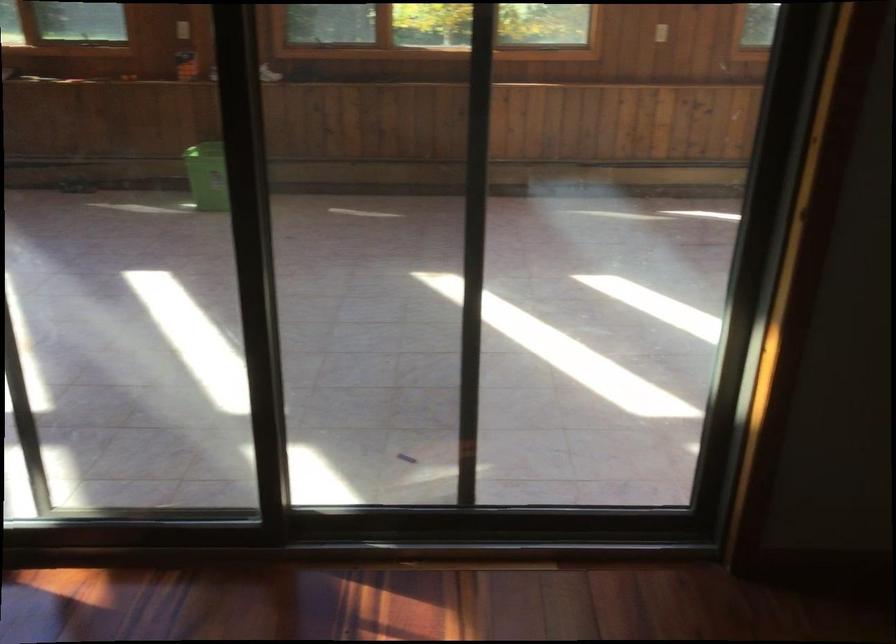
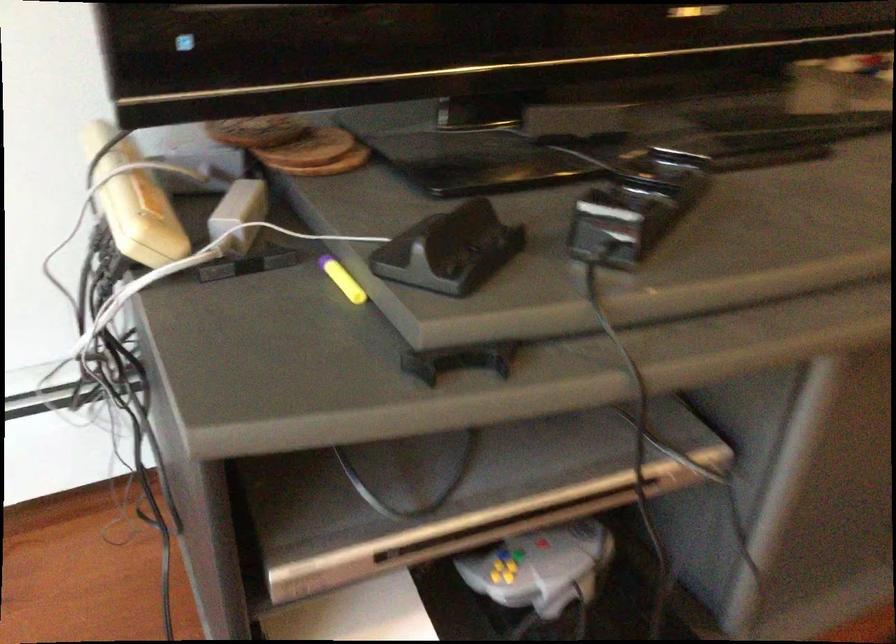
First-person continuous shooting, in which direction is the camera rotating?

The camera rotated toward right-down.